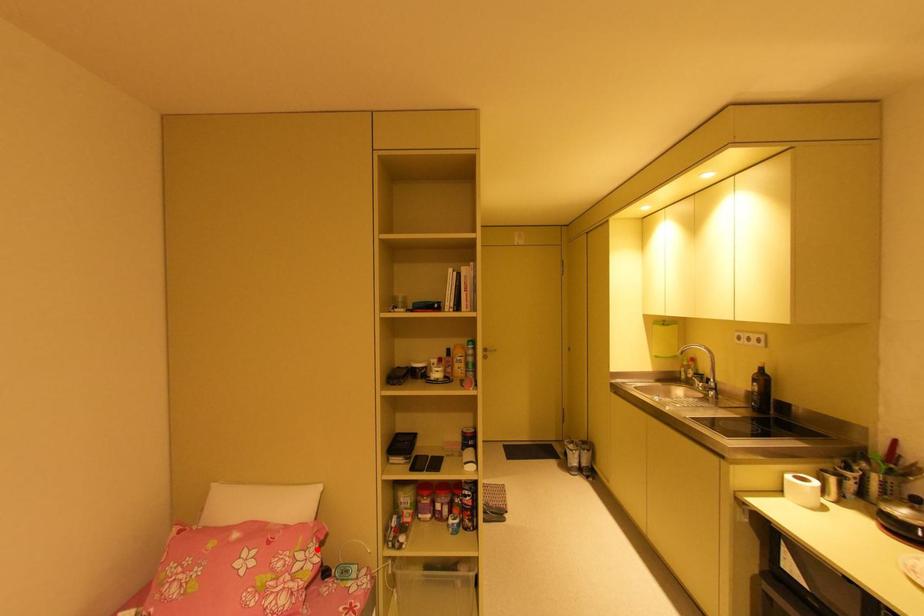
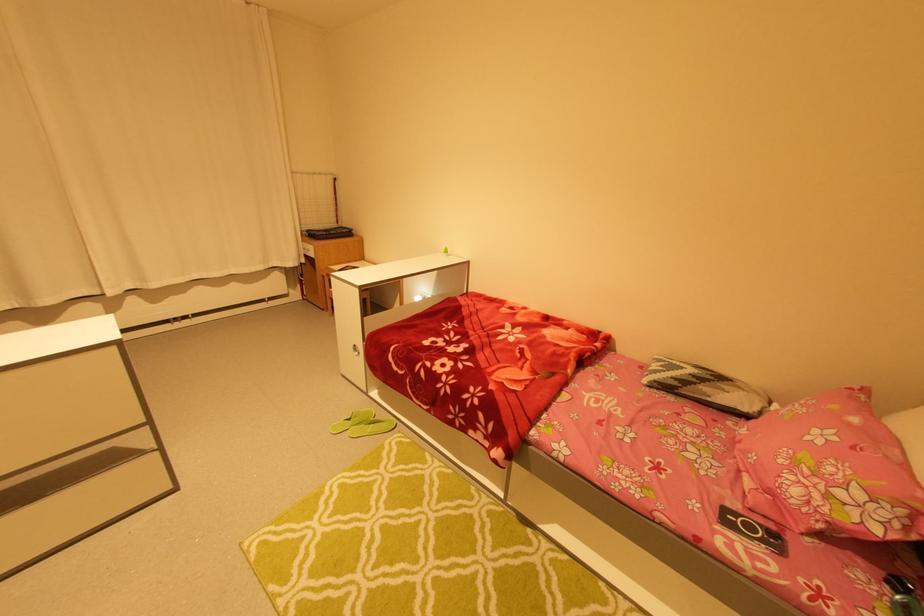
Question: I am providing you with two images of the same scene from different viewpoints. Image1 has a red point marked. In image2, the corresponding 3D location appears at what relative position? Reply with the corresponding letter.

Choices:
 (A) Closer
 (B) Farther

Answer: (B)